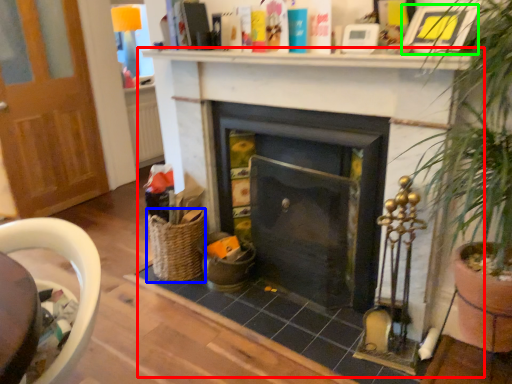
Question: Based on their relative distances, which object is nearer to fireplace (highlighted by a red box)? Choose from basket (highlighted by a blue box) and picture frame (highlighted by a green box).

Choices:
 (A) basket
 (B) picture frame

Answer: (A)